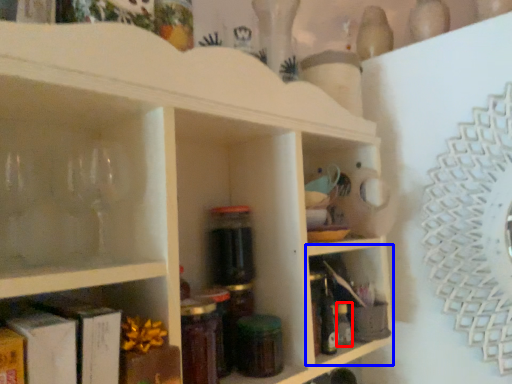
Question: Which object appears farthest to the camera in this image, bottle (highlighted by a red box) or shelf (highlighted by a blue box)?

Choices:
 (A) bottle
 (B) shelf

Answer: (A)